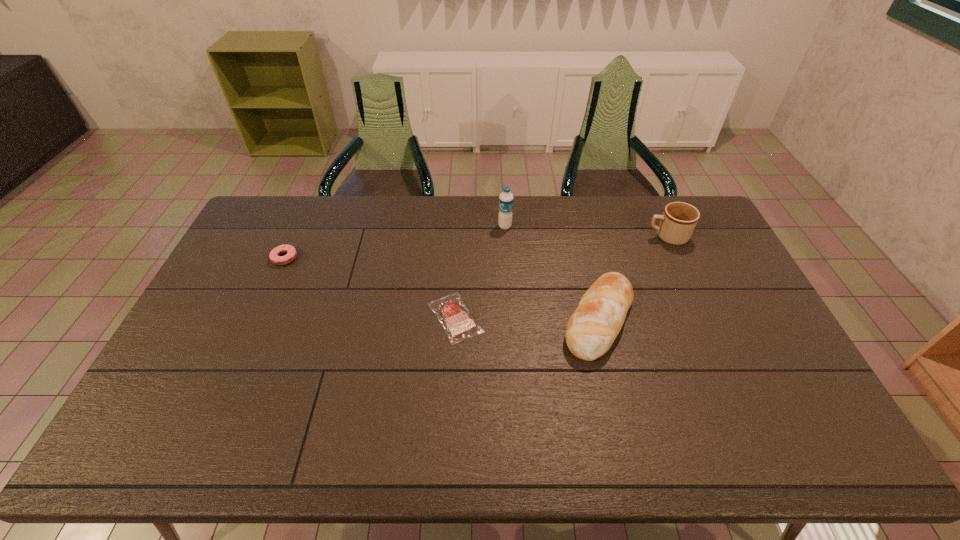
Identify the location of vacant space in between the second shortest object and the steak. (370, 288).

Where is `free spot between the mug and the tallest object`? The width and height of the screenshot is (960, 540). free spot between the mug and the tallest object is located at coordinates pos(586,232).

This screenshot has height=540, width=960. What are the coordinates of `free space between the second shortest object and the water bottle` in the screenshot? It's located at (395, 242).

Find the location of a particular element. Image resolution: width=960 pixels, height=540 pixels. free spot between the leftmost object and the steak is located at coordinates point(370,288).

Where is `vacant area that lies between the rightmost object and the second object from left to right`? The height and width of the screenshot is (540, 960). vacant area that lies between the rightmost object and the second object from left to right is located at coordinates (561, 277).

The image size is (960, 540). I want to click on free space between the steak and the water bottle, so click(x=480, y=272).

Identify the location of object that is the second closest to the third object from right to left. (451, 312).

This screenshot has height=540, width=960. What are the coordinates of `object that is the second closest one to the bread` in the screenshot? It's located at click(451, 312).

Where is `free spot that satisfies the following two spatial constraints: 1. on the label of the water bottle; 2. on the left side of the bread`? free spot that satisfies the following two spatial constraints: 1. on the label of the water bottle; 2. on the left side of the bread is located at coordinates pyautogui.click(x=511, y=320).

I want to click on free space in the image that satisfies the following two spatial constraints: 1. on the label of the bread; 2. on the right side of the tallest object, so click(511, 320).